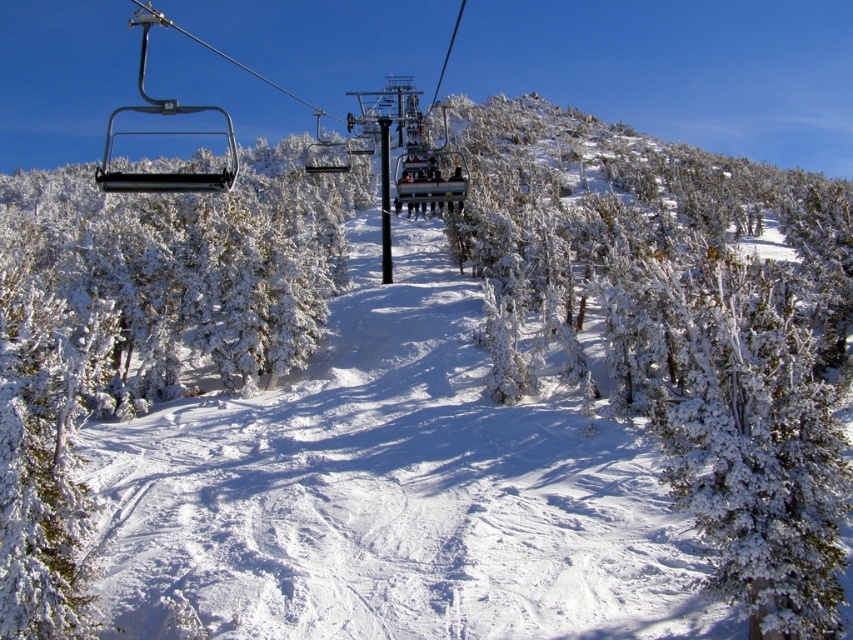
Question: Which point is farther to the camera?

Choices:
 (A) white frosty tree at left
 (B) snow-covered evergreen at center

Answer: (A)

Question: Does snow-covered evergreen at center appear over white frosty tree at left?

Choices:
 (A) no
 (B) yes

Answer: (B)

Question: Is snow-covered evergreen at center to the right of white frosty tree at left from the viewer's perspective?

Choices:
 (A) yes
 (B) no

Answer: (A)

Question: Which of the following is the closest to the observer?

Choices:
 (A) (683, 266)
 (B) (67, 596)

Answer: (B)

Question: Considering the relative positions of snow-covered evergreen at center and white frosty tree at left in the image provided, where is snow-covered evergreen at center located with respect to white frosty tree at left?

Choices:
 (A) above
 (B) below

Answer: (A)